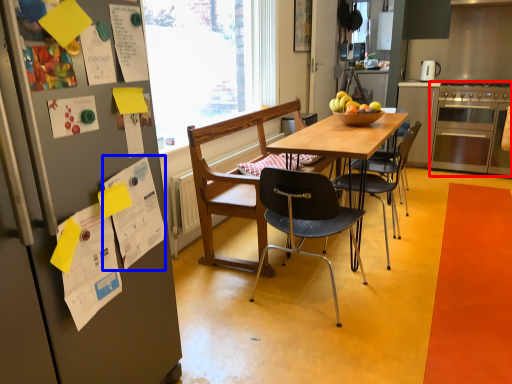
Question: Which point is closer to the camera, oven (highlighted by a red box) or poster (highlighted by a blue box)?

Choices:
 (A) oven
 (B) poster

Answer: (B)